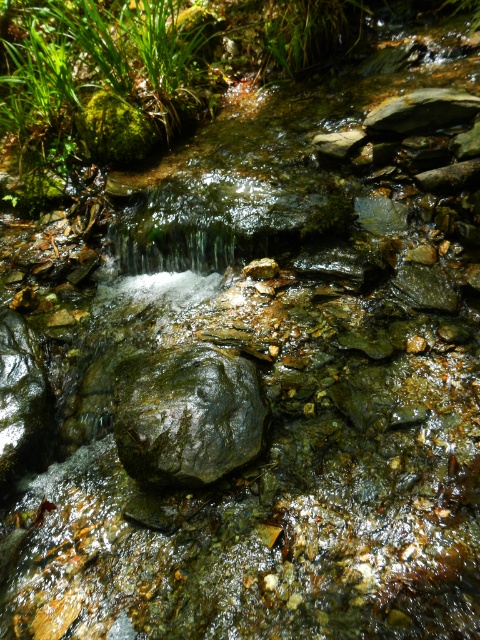
You are standing on the bank of the stream and want to cross to the other side. You notice two rocks that could help you cross. The shiny dark rock at center and the shiny dark rock at left. Which rock should you step on first if you want to cross the stream safely?

You should step on the shiny dark rock at center first because it might be wider than the shiny dark rock at left, providing a more stable footing for crossing the stream safely.

Looking at this image, you are standing at the edge of the stream and see the point marked at coordinates [188,413]. What object is located at that point?

The point at coordinates [188,413] corresponds to the shiny dark rock at center.